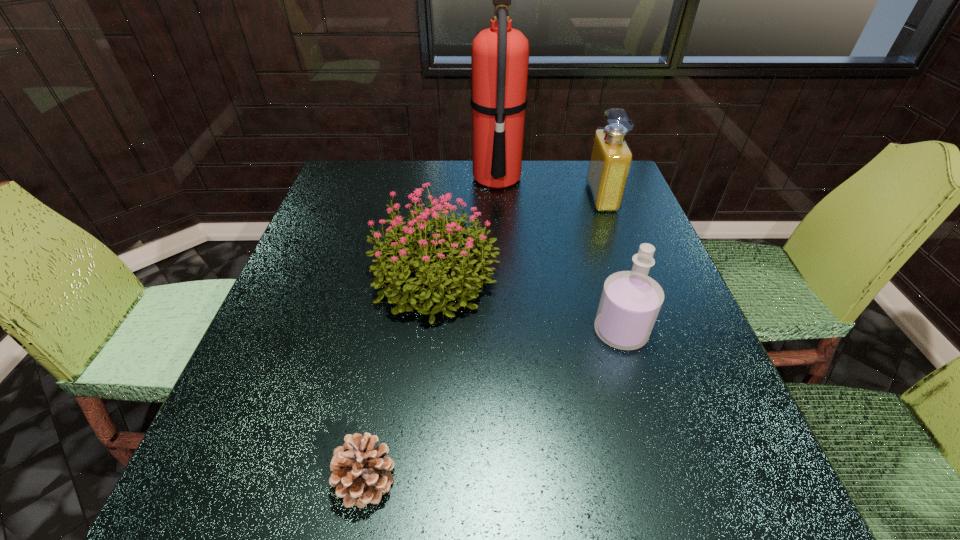
This screenshot has height=540, width=960. What are the coordinates of `the tallest object` in the screenshot? It's located at (500, 54).

You are a GUI agent. You are given a task and a screenshot of the screen. Output one action in this format:
    pyautogui.click(x=<x>, y=<y>)
    Task: Click on the farther perfume
    The image size is (960, 540).
    Given the screenshot: What is the action you would take?
    pyautogui.click(x=611, y=158)

In order to click on bouquet in this screenshot , I will do `click(460, 270)`.

Where is `the nearer perfume`? This screenshot has width=960, height=540. the nearer perfume is located at coordinates (630, 302).

Identify the location of the nearest object. (361, 473).

Find the location of `pinecone`. pinecone is located at coordinates (361, 473).

Identify the location of free point located at the nozzle of the tallest object. This screenshot has height=540, width=960. (442, 179).

The height and width of the screenshot is (540, 960). Find the location of `vacant region located at the nozzle of the tallest object`. vacant region located at the nozzle of the tallest object is located at coordinates (395, 179).

Find the location of `free space located 0.400m at the nozzle of the tallest object`. free space located 0.400m at the nozzle of the tallest object is located at coordinates (338, 179).

Where is `free point located 0.250m on the front-facing side of the farther perfume`? free point located 0.250m on the front-facing side of the farther perfume is located at coordinates (501, 197).